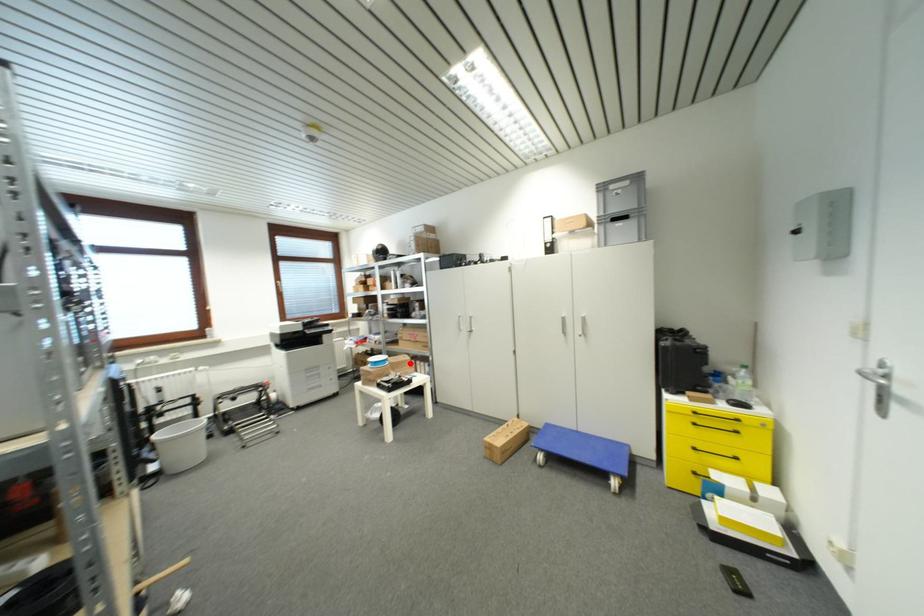
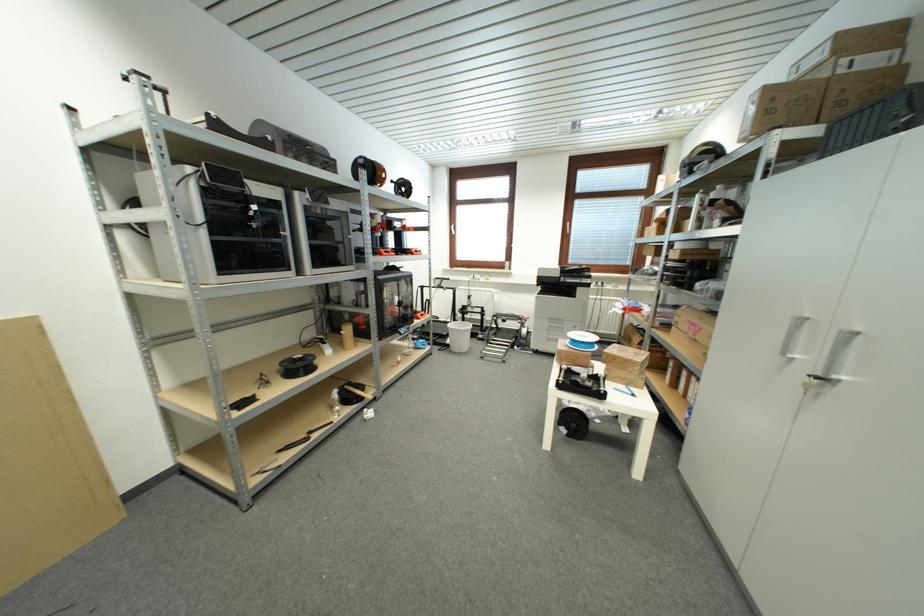
Find the pixel in the second image that matches the highlighted location in the first image.

(634, 363)